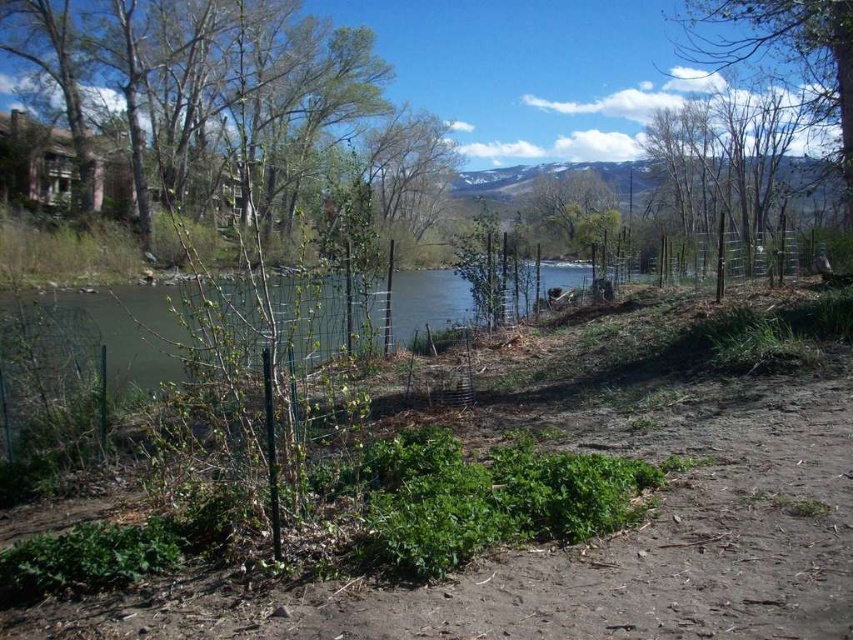
This screenshot has width=853, height=640. Identify the location of green leafy tree at upper left. [x=245, y=109].

Is green leafy tree at upper left bigger than green leafy tree at center?

Yes.

Is point (126, 102) farther from viewer compared to point (585, 208)?

No.

Locate an element on the screen. This screenshot has width=853, height=640. green leafy tree at upper left is located at coordinates (245, 109).

Is green leafy tree at upper right taller than green leafy tree at center?

Yes, green leafy tree at upper right is taller than green leafy tree at center.

Is point (843, 116) farther from camera compared to point (604, 241)?

No, it is not.

Which is in front, point (825, 10) or point (581, 216)?

Point (825, 10) is more forward.

You are a GUI agent. You are given a task and a screenshot of the screen. Output one action in this format:
    pyautogui.click(x=<x>, y=<y>)
    Task: Click on the green leafy tree at upper right
    
    Given the screenshot: What is the action you would take?
    785,52

Describe the element at coordinates (245, 109) in the screenshot. I see `green leafy tree at upper left` at that location.

Can you confirm if green leafy tree at upper left is thinner than green leafy tree at upper right?

Incorrect, green leafy tree at upper left's width is not less than green leafy tree at upper right's.

Find the location of a particular element. This screenshot has width=853, height=640. green leafy tree at upper left is located at coordinates (245, 109).

At what (x,y) coordinates should I click in order to perform the action: click on green leafy tree at upper left. Please return your answer as a coordinate pair (x, y). The image size is (853, 640). Looking at the image, I should click on (245, 109).